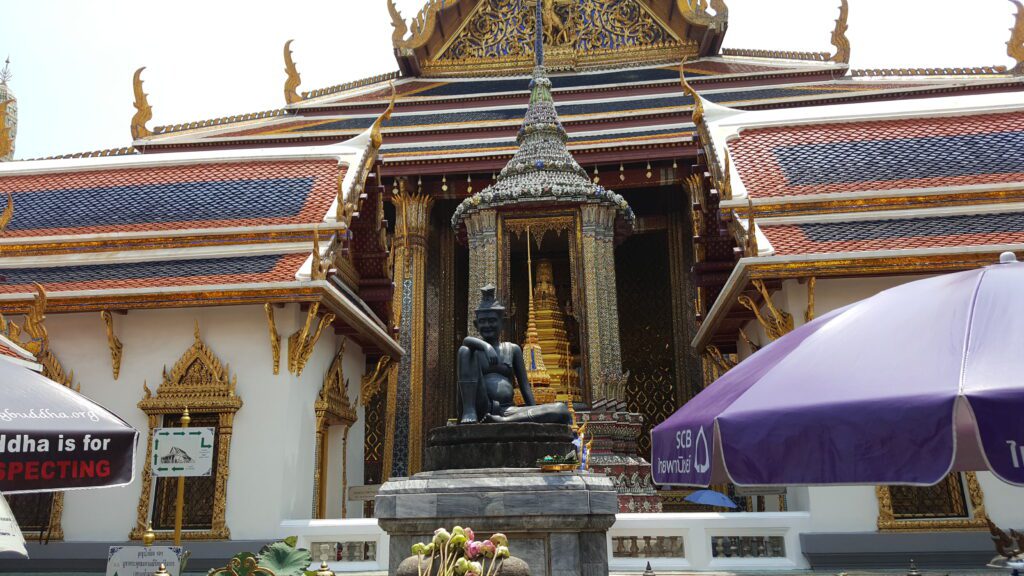
Identify the location of statue base. This screenshot has height=576, width=1024. (479, 450).